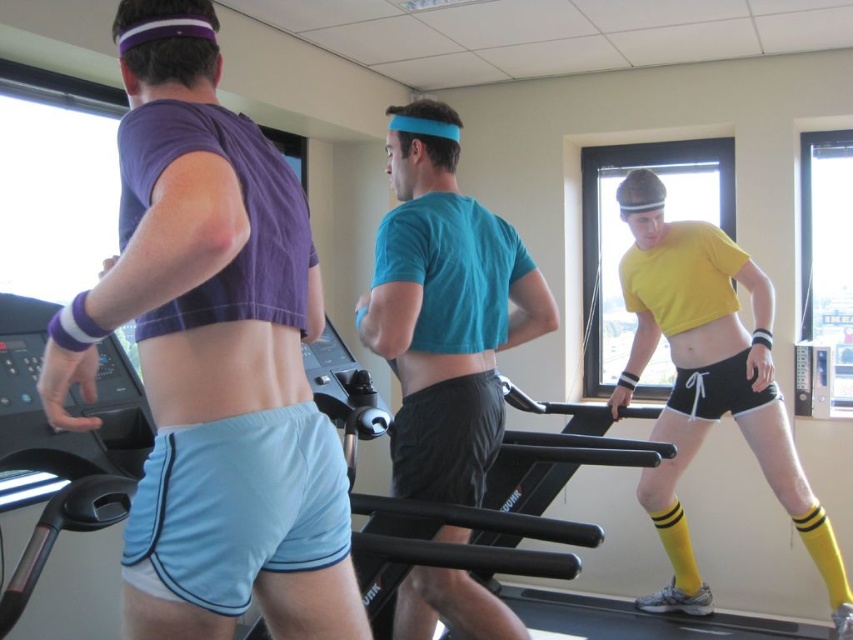
Does teal matte t-shirt at center appear on the right side of yellow matte shorts at center?

No, teal matte t-shirt at center is not to the right of yellow matte shorts at center.

The height and width of the screenshot is (640, 853). Describe the element at coordinates (444, 308) in the screenshot. I see `teal matte t-shirt at center` at that location.

Which is behind, point (445, 177) or point (698, 355)?

Positioned behind is point (698, 355).

You are a GUI agent. You are given a task and a screenshot of the screen. Output one action in this format:
    pyautogui.click(x=<x>, y=<y>)
    Task: Click on the teal matte t-shirt at center
    Image resolution: width=853 pixels, height=640 pixels.
    Given the screenshot: What is the action you would take?
    pyautogui.click(x=444, y=308)

Does matte purple t-shirt at left appear under teal matte t-shirt at center?

No.

This screenshot has width=853, height=640. I want to click on matte purple t-shirt at left, so click(x=212, y=355).

Is point (177, 196) farther from viewer compared to point (457, 358)?

No, (177, 196) is closer to viewer.

Locate an element on the screen. The height and width of the screenshot is (640, 853). matte purple t-shirt at left is located at coordinates (212, 355).

Is matte purple t-shirt at left wider than yellow matte shorts at center?

In fact, matte purple t-shirt at left might be narrower than yellow matte shorts at center.

Between matte purple t-shirt at left and yellow matte shorts at center, which one has less height?

matte purple t-shirt at left

Between point (213, 166) and point (751, 392), which one is positioned in front?

Point (213, 166)

Locate an element on the screen. matte purple t-shirt at left is located at coordinates (212, 355).